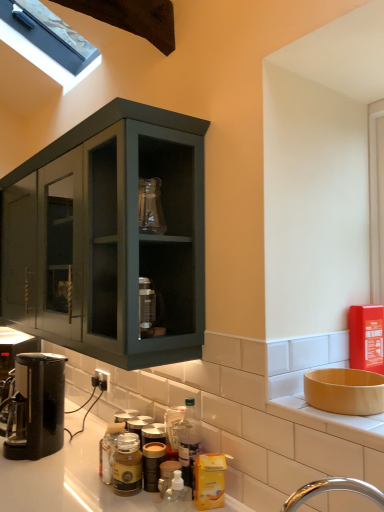
Question: In terms of size, does black plastic electric outlet at lower left appear bigger or smaller than matte yellow bowl at right?

Choices:
 (A) big
 (B) small

Answer: (B)

Question: From the image's perspective, is black plastic electric outlet at lower left above or below matte yellow bowl at right?

Choices:
 (A) above
 (B) below

Answer: (B)

Question: Estimate the real-world distances between objects in this image. Which object is farther from the black plastic coffee machine at lower left, positioned as the first coffee machine in left-to-right order?

Choices:
 (A) matte yellow bowl at right
 (B) matte glass jar at center, arranged as the 2th bottle when viewed from the back
 (C) translucent plastic bottle at lower center, which is the second bottle from right to left
 (D) translucent plastic bottle at lower center, arranged as the first bottle when viewed from the front
 (E) black plastic coffee machine at lower left, arranged as the 2th coffee machine when viewed from the back

Answer: (A)

Question: Which is nearer to the matte yellow bowl at right?

Choices:
 (A) black plastic coffee machine at lower left, the first coffee machine when ordered from front to back
 (B) yellow plastic bottle at lower center, positioned as the fourth bottle in left-to-right order
 (C) matte glass jar at center, marked as the first bottle in a left-to-right arrangement
 (D) translucent plastic bottle at lower center, which is the second bottle from right to left
 (E) translucent plastic bottle at lower center, placed as the 2th bottle when sorted from left to right

Answer: (B)